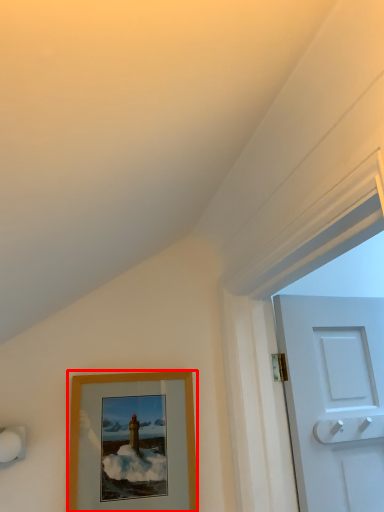
Question: From the image, what is the correct spatial relationship of picture frame (annotated by the red box) in relation to door handle?

Choices:
 (A) right
 (B) left

Answer: (B)